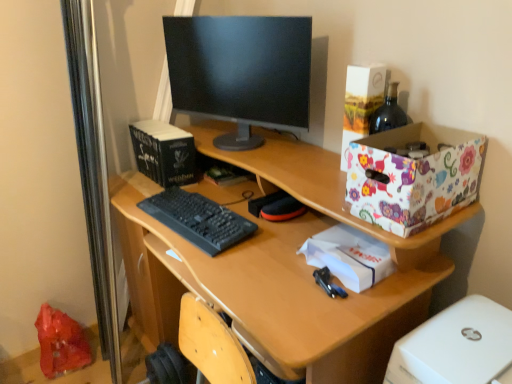
Question: Which direction should I rotate to face hardcover book at center, placed as the first book when sorted from right to left, — up or down?

Choices:
 (A) up
 (B) down

Answer: (A)

Question: From the image's perspective, is floral-patterned cardboard box at upper right on white paper at center?

Choices:
 (A) yes
 (B) no

Answer: (A)

Question: Can you confirm if floral-patterned cardboard box at upper right is shorter than white paper at center?

Choices:
 (A) yes
 (B) no

Answer: (B)

Question: Is floral-patterned cardboard box at upper right not inside white paper at center?

Choices:
 (A) yes
 (B) no

Answer: (A)

Question: Could you tell me if floral-patterned cardboard box at upper right is turned towards white paper at center?

Choices:
 (A) no
 (B) yes

Answer: (A)

Question: Are floral-patterned cardboard box at upper right and white paper at center beside each other?

Choices:
 (A) no
 (B) yes

Answer: (A)

Question: From the image's perspective, does floral-patterned cardboard box at upper right appear lower than white paper at center?

Choices:
 (A) yes
 (B) no

Answer: (B)

Question: Is black glossy monitor at center facing towards white paper at center?

Choices:
 (A) yes
 (B) no

Answer: (B)

Question: Does black glossy monitor at center have a lesser width compared to white paper at center?

Choices:
 (A) no
 (B) yes

Answer: (B)

Question: From the image's perspective, is black glossy monitor at center beneath white paper at center?

Choices:
 (A) yes
 (B) no

Answer: (B)

Question: From a real-world perspective, is black glossy monitor at center positioned over white paper at center based on gravity?

Choices:
 (A) no
 (B) yes

Answer: (B)

Question: Is there a large distance between black glossy monitor at center and white paper at center?

Choices:
 (A) no
 (B) yes

Answer: (A)

Question: Is black glossy monitor at center positioned behind white paper at center?

Choices:
 (A) yes
 (B) no

Answer: (A)

Question: Is white paper at center further to the viewer compared to floral-patterned cardboard box at upper right?

Choices:
 (A) no
 (B) yes

Answer: (B)